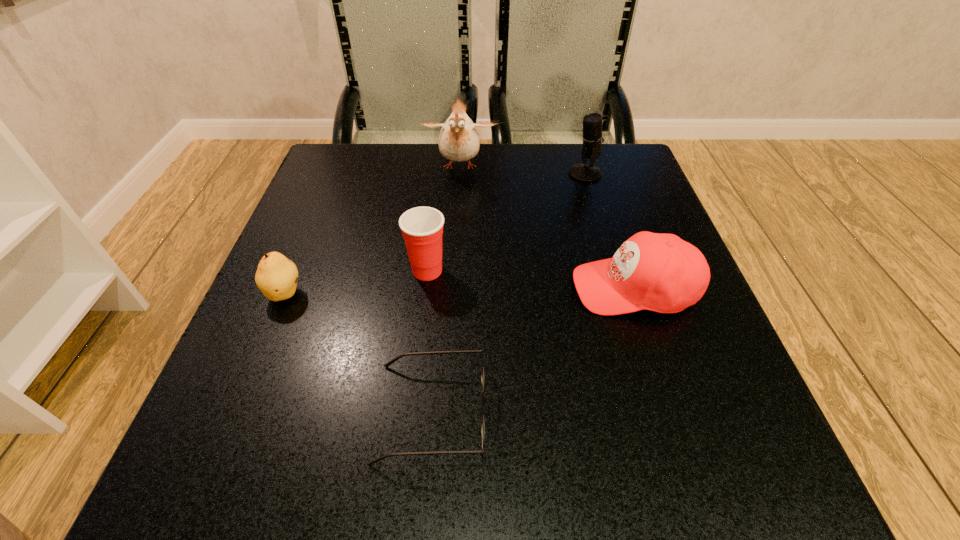
The image size is (960, 540). Identify the location of bird. (458, 141).

Locate an element on the screen. This screenshot has width=960, height=540. microphone is located at coordinates (592, 137).

Locate an element on the screen. Dixie cup is located at coordinates (422, 227).

The height and width of the screenshot is (540, 960). What are the coordinates of `baseball cap` in the screenshot? It's located at (658, 272).

Locate an element on the screen. This screenshot has height=540, width=960. the second shortest object is located at coordinates (276, 276).

The height and width of the screenshot is (540, 960). In order to click on the leftmost object in this screenshot , I will do `click(276, 276)`.

The width and height of the screenshot is (960, 540). Find the location of `the shortest object`. the shortest object is located at coordinates (389, 363).

Image resolution: width=960 pixels, height=540 pixels. I want to click on spectacles, so click(389, 363).

Find the location of `blank area located 0.160m at the beak of the bird`. blank area located 0.160m at the beak of the bird is located at coordinates (456, 230).

Find the location of a particular element. The image size is (960, 540). vacant space located on the front of the microphone is located at coordinates click(x=592, y=199).